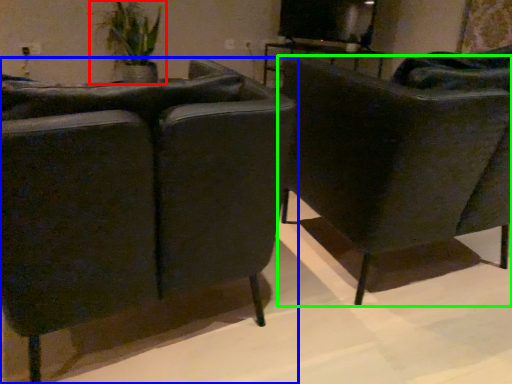
Question: Which is nearer to the houseplant (highlighted by a red box)? chair (highlighted by a blue box) or chair (highlighted by a green box).

Choices:
 (A) chair
 (B) chair

Answer: (B)